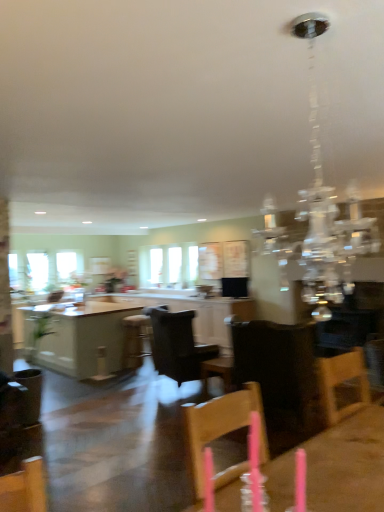
The height and width of the screenshot is (512, 384). Find the location of `wooden bar stool at center`. wooden bar stool at center is located at coordinates (135, 340).

The image size is (384, 512). What do you see at coordinates (135, 340) in the screenshot? I see `wooden bar stool at center` at bounding box center [135, 340].

At what (x,y) coordinates should I click in order to perform the action: click on wooden bar stool at center. Please return your answer as a coordinate pair (x, y). Looking at the image, I should click on (135, 340).

In the scene shown: Considering the relative sizes of black leather chair at center, the 2th chair positioned from the right, and clear crystal chandelier at upper center in the image provided, is black leather chair at center, the 2th chair positioned from the right, smaller than clear crystal chandelier at upper center?

No, black leather chair at center, the 2th chair positioned from the right, is not smaller than clear crystal chandelier at upper center.

Does black leather chair at center, the 2th chair positioned from the front, turn towards clear crystal chandelier at upper center?

No, black leather chair at center, the 2th chair positioned from the front, does not turn towards clear crystal chandelier at upper center.

Does black leather chair at center, the 2th chair positioned from the front, have a lesser width compared to clear crystal chandelier at upper center?

In fact, black leather chair at center, the 2th chair positioned from the front, might be wider than clear crystal chandelier at upper center.

From the image's perspective, who appears lower, dark brown leather chair at center, which is counted as the first chair, starting from the right, or clear glass window at left, positioned as the 1th window in left-to-right order?

From the image's view, dark brown leather chair at center, which is counted as the first chair, starting from the right, is below.

In the scene shown: From a real-world perspective, relative to clear glass window at left, marked as the second window in a right-to-left arrangement, is dark brown leather chair at center, the second chair viewed from the left, vertically above or below?

Clearly, from a real-world perspective, dark brown leather chair at center, the second chair viewed from the left, is below clear glass window at left, marked as the second window in a right-to-left arrangement.

The height and width of the screenshot is (512, 384). In order to click on chair that is the 1st object located below the clear glass window at left, marked as the second window in a right-to-left arrangement (from the image's perspective) in this screenshot , I will do `click(278, 371)`.

Can you confirm if dark brown leather chair at center, which is the second chair from back to front, is wider than clear glass window at left, marked as the second window in a right-to-left arrangement?

Correct, the width of dark brown leather chair at center, which is the second chair from back to front, exceeds that of clear glass window at left, marked as the second window in a right-to-left arrangement.

What's the angular difference between clear glass window at left, marked as the second window in a right-to-left arrangement, and wooden table at center, arranged as the 1th table when viewed from the top,'s facing directions?

The angle between the facing direction of clear glass window at left, marked as the second window in a right-to-left arrangement, and the facing direction of wooden table at center, arranged as the 1th table when viewed from the top, is 179 degrees.

Image resolution: width=384 pixels, height=512 pixels. In order to click on window that is the 1st one when counting upward from the wooden table at center, the 1th table viewed from the right (from the image's perspective) in this screenshot , I will do `click(66, 265)`.

Considering the sizes of objects clear glass window at left, positioned as the 1th window in left-to-right order, and wooden table at center, the second table when ordered from left to right, in the image provided, who is taller, clear glass window at left, positioned as the 1th window in left-to-right order, or wooden table at center, the second table when ordered from left to right,?

Standing taller between the two is clear glass window at left, positioned as the 1th window in left-to-right order.

Find the location of a particular element. This screenshot has height=512, width=384. the 1st chair behind the wooden table at center, marked as the 2th table in a bottom-to-top arrangement, starting your count from the anchor is located at coordinates (278, 371).

Considering the relative positions of wooden table at center, arranged as the 1th table when viewed from the top, and dark brown leather chair at center, which is the second chair from back to front, in the image provided, is wooden table at center, arranged as the 1th table when viewed from the top, to the left of dark brown leather chair at center, which is the second chair from back to front, from the viewer's perspective?

Indeed, wooden table at center, arranged as the 1th table when viewed from the top, is positioned on the left side of dark brown leather chair at center, which is the second chair from back to front.

Which object is thinner, wooden table at center, arranged as the 1th table when viewed from the top, or dark brown leather chair at center, which is the second chair from back to front?

wooden table at center, arranged as the 1th table when viewed from the top, is thinner.

Is wooden table at center, positioned as the 1th table in front-to-back order, positioned in front of dark brown leather chair at center, the second chair viewed from the left?

Yes.

Considering the relative sizes of wooden bar stool at center and dark brown leather chair at center, the second chair viewed from the left, in the image provided, is wooden bar stool at center taller than dark brown leather chair at center, the second chair viewed from the left,?

Incorrect, the height of wooden bar stool at center is not larger of that of dark brown leather chair at center, the second chair viewed from the left.

Is wooden bar stool at center looking in the opposite direction of dark brown leather chair at center, which is the first chair in front-to-back order?

Yes.

From the image's perspective, between wooden bar stool at center and dark brown leather chair at center, which is the first chair in front-to-back order, which one is located above?

dark brown leather chair at center, which is the first chair in front-to-back order.

Is wooden bar stool at center bigger than dark brown leather chair at center, which is the first chair in front-to-back order?

No.

Consider the image. Can you confirm if clear glass window at center, the first window from the right, is shorter than white glossy cabinetry at center?

No, clear glass window at center, the first window from the right, is not shorter than white glossy cabinetry at center.

How many degrees apart are the facing directions of clear glass window at center, which appears as the second window when viewed from the left, and white glossy cabinetry at center?

There is a 89.1-degree angle between the facing directions of clear glass window at center, which appears as the second window when viewed from the left, and white glossy cabinetry at center.

From a real-world perspective, relative to white glossy cabinetry at center, is clear glass window at center, which appears as the second window when viewed from the left, vertically above or below?

In terms of real-world spatial position, clear glass window at center, which appears as the second window when viewed from the left, is above white glossy cabinetry at center.

In terms of size, does clear glass window at center, which appears as the second window when viewed from the left, appear bigger or smaller than white glossy cabinetry at center?

Clearly, clear glass window at center, which appears as the second window when viewed from the left, is smaller in size than white glossy cabinetry at center.

Considering the positions of objects black leather chair at center, the 2th chair positioned from the front, and clear glass window at left, marked as the second window in a right-to-left arrangement, in the image provided, who is in front, black leather chair at center, the 2th chair positioned from the front, or clear glass window at left, marked as the second window in a right-to-left arrangement,?

Positioned in front is black leather chair at center, the 2th chair positioned from the front.

Is point (183, 355) closer or farther from the camera than point (67, 262)?

Point (183, 355) is closer to the camera than point (67, 262).

Is black leather chair at center, positioned as the 1th chair in back-to-front order, at the right side of clear glass window at left, marked as the second window in a right-to-left arrangement?

Yes, black leather chair at center, positioned as the 1th chair in back-to-front order, is to the right of clear glass window at left, marked as the second window in a right-to-left arrangement.

You are a GUI agent. You are given a task and a screenshot of the screen. Output one action in this format:
    pyautogui.click(x=<x>, y=<y>)
    Task: Click on the light fixture above the black leather chair at center, the 2th chair positioned from the front (from a real-world perspective)
    
    Given the screenshot: What is the action you would take?
    pyautogui.click(x=274, y=289)

I want to click on the 2nd window counting from the left of the dark brown leather chair at center, the second chair viewed from the left, so click(x=66, y=265).

Considering their positions, is clear crystal chandelier at upper center positioned further to wooden bar stool at center than white glossy table at center, marked as the 1th table in a back-to-front arrangement?

clear crystal chandelier at upper center is further to wooden bar stool at center.

Consider the image. Which object lies further to the anchor point black leather chair at center, the 2th chair positioned from the front, wooden table at center, the 1th table viewed from the right, or white glossy table at center, arranged as the second table when viewed from the right?

wooden table at center, the 1th table viewed from the right, is positioned further to the anchor black leather chair at center, the 2th chair positioned from the front.

Which object lies nearer to the anchor point wooden bar stool at center, dark brown leather chair at center, which is counted as the first chair, starting from the right, or white glossy cabinetry at center?

white glossy cabinetry at center is positioned closer to the anchor wooden bar stool at center.

Considering their positions, is wooden bar stool at center positioned further to white glossy cabinetry at center than clear glass window at center, the first window from the right?

clear glass window at center, the first window from the right.

From the image, which object appears to be nearer to white glossy cabinetry at center, white glossy table at center, marked as the 1th table in a back-to-front arrangement, or wooden table at center, arranged as the 1th table when viewed from the top?

white glossy table at center, marked as the 1th table in a back-to-front arrangement, is positioned closer to the anchor white glossy cabinetry at center.

Based on the photo, when comparing their distances from wooden table at center, the second table positioned from the back, does clear glass window at left, positioned as the 1th window in left-to-right order, or black leather chair at center, positioned as the 1th chair in back-to-front order, seem further?

Among the two, clear glass window at left, positioned as the 1th window in left-to-right order, is located further to wooden table at center, the second table positioned from the back.

When comparing their distances from clear glass window at center, the first window from the right, does wooden table at center, positioned as the 1th table in front-to-back order, or dark brown leather chair at center, which is counted as the first chair, starting from the right, seem further?

wooden table at center, positioned as the 1th table in front-to-back order, lies further to clear glass window at center, the first window from the right, than the other object.

Which object lies nearer to the anchor point white glossy cabinetry at center, wooden table at center, marked as the 2th table in a bottom-to-top arrangement, or dark brown leather chair at center, the second chair viewed from the left?

dark brown leather chair at center, the second chair viewed from the left, is closer to white glossy cabinetry at center.

This screenshot has width=384, height=512. In order to click on bar stool between white glossy table at center, marked as the 1th table in a back-to-front arrangement, and clear glass window at center, the first window from the right, along the z-axis in this screenshot , I will do `click(135, 340)`.

Find the location of a particular element. The height and width of the screenshot is (512, 384). light fixture between wooden table at center, the second table positioned from the back, and dark brown leather chair at center, which is counted as the first chair, starting from the right, in the front-back direction is located at coordinates (274, 289).

Find the location of a particular element. table located between white glossy cabinetry at center and clear glass window at center, which appears as the second window when viewed from the left, in the depth direction is located at coordinates (85, 338).

Find the location of a particular element. window between black leather chair at center, the 2th chair positioned from the right, and clear glass window at left, positioned as the 1th window in left-to-right order, from front to back is located at coordinates (156, 265).